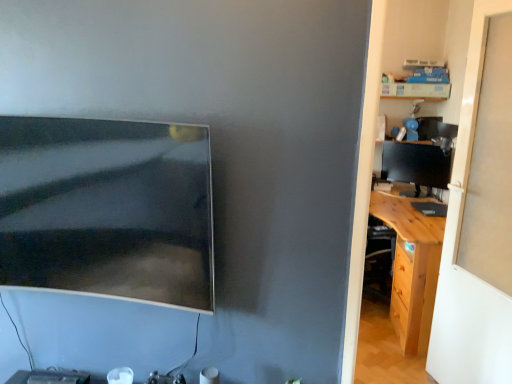
Question: Based on their sizes in the image, would you say wooden desk at right is bigger or smaller than matte black monitor at upper left, the 2th computer monitor from the right?

Choices:
 (A) small
 (B) big

Answer: (A)

Question: From the image's perspective, is wooden desk at right above or below matte black monitor at upper left, the 2th computer monitor from the right?

Choices:
 (A) above
 (B) below

Answer: (B)

Question: Which of these objects is positioned farthest from the matte black monitor at upper left, the 2th computer monitor positioned from the back?

Choices:
 (A) wooden desk at right
 (B) matte black monitor at right, placed as the second computer monitor when sorted from left to right
 (C) light brown wood desk at right

Answer: (A)

Question: Which object is positioned farthest from the wooden desk at right?

Choices:
 (A) matte black monitor at right, marked as the 2th computer monitor in a front-to-back arrangement
 (B) light brown wood desk at right
 (C) matte black monitor at upper left, the 2th computer monitor positioned from the back

Answer: (C)